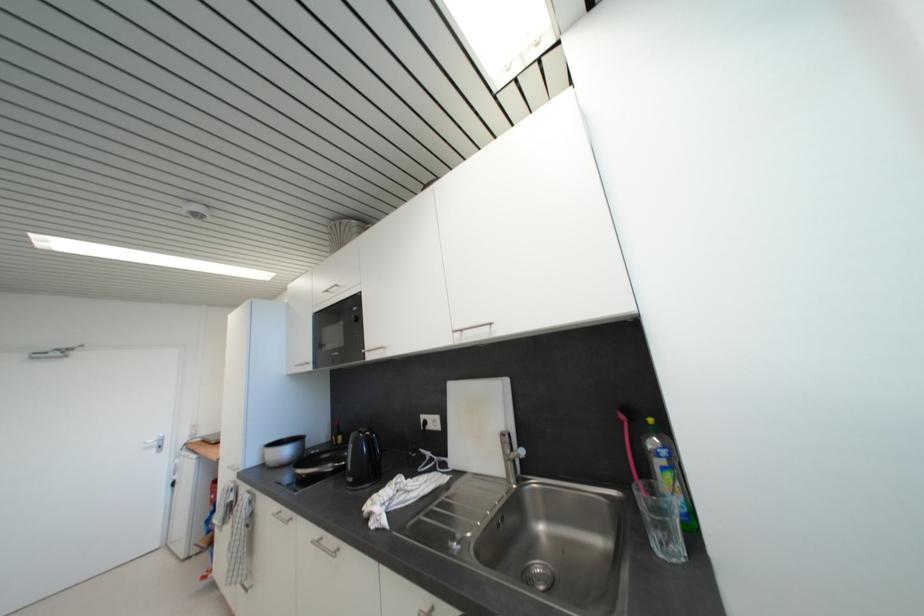
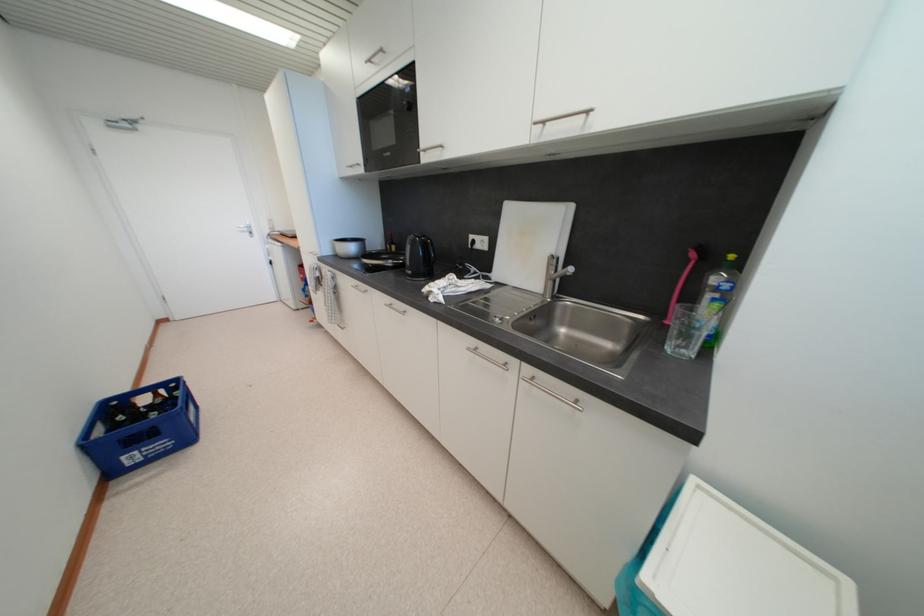
Find the pixel in the second image that matches point (154, 450) in the first image.

(248, 235)